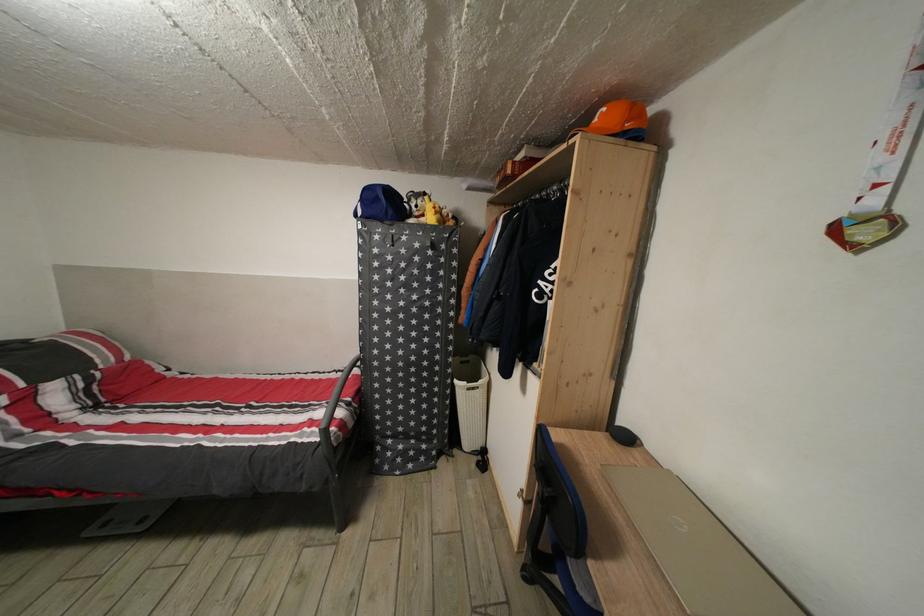
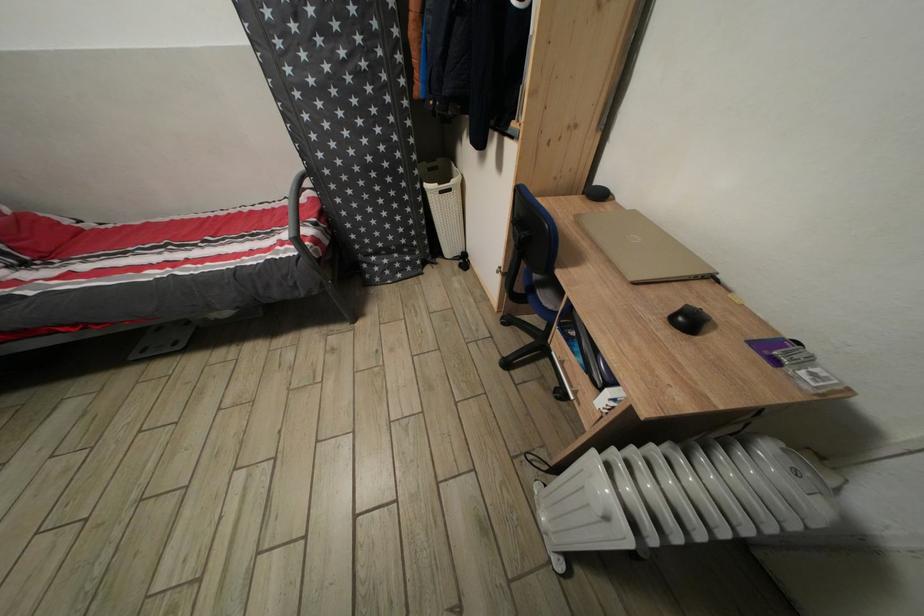
Find the pixel in the second image that matches (x=531, y=573) in the first image.

(509, 325)